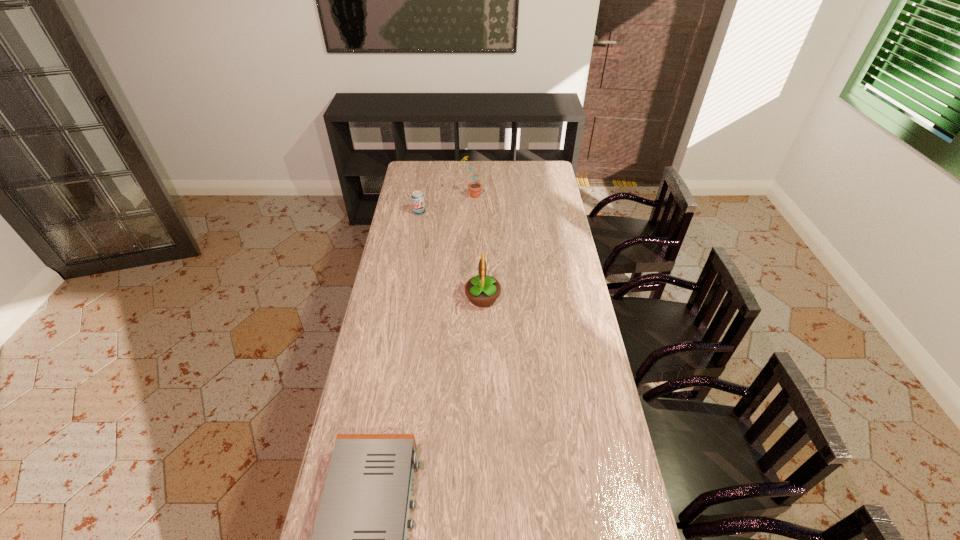
At what (x,y) coordinates should I click in order to perform the action: click on vacant space at the far edge of the desktop. Please return your answer as a coordinate pair (x, y). Image resolution: width=960 pixels, height=540 pixels. Looking at the image, I should click on (492, 170).

Where is `free space at the left edge`? free space at the left edge is located at coordinates (396, 251).

You are a GUI agent. You are given a task and a screenshot of the screen. Output one action in this format:
    pyautogui.click(x=<x>, y=<y>)
    Task: Click on the vacant space at the right edge of the desktop
    Image resolution: width=960 pixels, height=540 pixels.
    Given the screenshot: What is the action you would take?
    pyautogui.click(x=587, y=422)

I want to click on free space at the far right corner of the desktop, so click(530, 171).

This screenshot has height=540, width=960. In order to click on free spot between the third tallest object and the nearer sunflower in this screenshot , I will do `click(451, 255)`.

Locate an element on the screen. This screenshot has width=960, height=540. empty space between the farther sunflower and the third tallest object is located at coordinates (445, 204).

You are a GUI agent. You are given a task and a screenshot of the screen. Output one action in this format:
    pyautogui.click(x=<x>, y=<y>)
    Task: Click on the blank region between the second farthest object and the nearer sunflower
    The image size is (960, 540).
    Given the screenshot: What is the action you would take?
    pyautogui.click(x=451, y=255)

Where is `empty space between the farther sunflower and the beer can`? The width and height of the screenshot is (960, 540). empty space between the farther sunflower and the beer can is located at coordinates (445, 204).

Where is `free space between the third tallest object and the farther sunflower`? Image resolution: width=960 pixels, height=540 pixels. free space between the third tallest object and the farther sunflower is located at coordinates (445, 204).

Identify the location of object that is the nearest to the radio receiver. (482, 290).